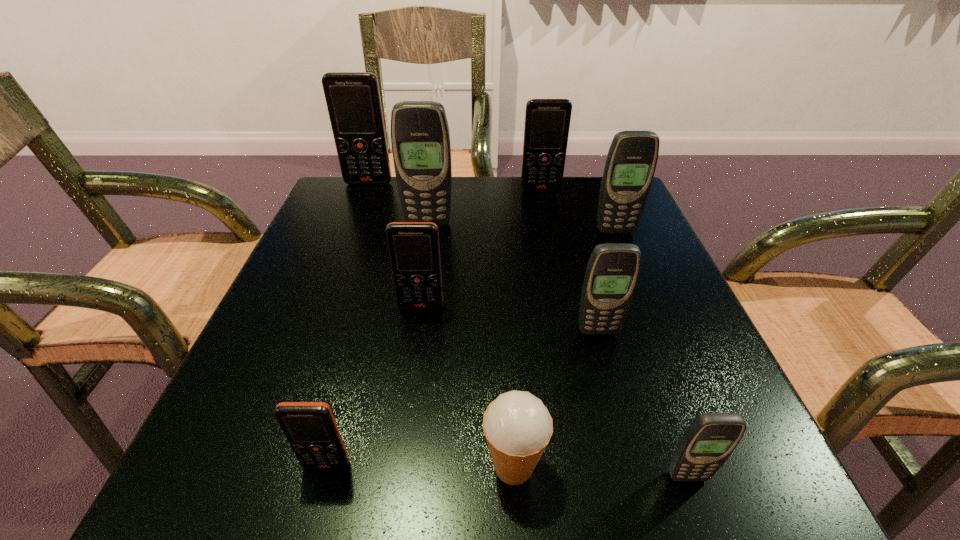
Choose which object is the seventh nearest neighbor to the third orange cellular telephone from left to right. Please provide its 2D coordinates. Your answer should be formatted as a tuple, i.e. [(x, y)], where the tuple contains the x and y coordinates of a point satisfying the conditions above.

[(547, 121)]

Select which cellular telephone appears as the third closest to the smallest gray cellular telephone. Please provide its 2D coordinates. Your answer should be formatted as a tuple, i.e. [(x, y)], where the tuple contains the x and y coordinates of a point satisfying the conditions above.

[(414, 252)]

Locate an element on the screen. This screenshot has width=960, height=540. cellular telephone that is the fourth nearest to the nearest orange cellular telephone is located at coordinates (420, 137).

What are the coordinates of `the second closest orange cellular telephone to the icecream` in the screenshot? It's located at (414, 252).

Locate an element on the screen. Image resolution: width=960 pixels, height=540 pixels. orange cellular telephone that is the third closest to the fifth nearest object is located at coordinates (353, 100).

Where is `gray cellular telephone object that ranks as the second closest to the fifth object from right to left`? Image resolution: width=960 pixels, height=540 pixels. gray cellular telephone object that ranks as the second closest to the fifth object from right to left is located at coordinates (612, 272).

Identify which gray cellular telephone is the fourth closest to the icecream. Please provide its 2D coordinates. Your answer should be formatted as a tuple, i.e. [(x, y)], where the tuple contains the x and y coordinates of a point satisfying the conditions above.

[(420, 137)]

What are the coordinates of `vacant space that satisfies the following two spatial constraints: 1. on the screen of the farthest orange cellular telephone; 2. on the left side of the icecream` in the screenshot? It's located at tap(260, 466).

At what (x,y) coordinates should I click in order to perform the action: click on vacant space that satisfies the following two spatial constraints: 1. on the screen of the icecream; 2. on the left side of the nearest orange cellular telephone. Please return your answer as a coordinate pair (x, y). This screenshot has width=960, height=540. Looking at the image, I should click on (326, 466).

Image resolution: width=960 pixels, height=540 pixels. Identify the location of free space that satisfies the following two spatial constraints: 1. on the screen of the second smallest orange cellular telephone; 2. on the right side of the fifth object from left to right. (398, 466).